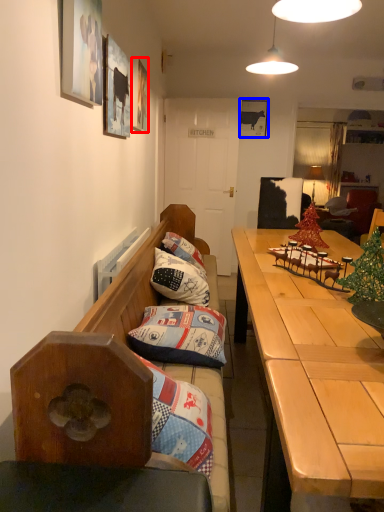
Question: Which object appears closest to the camera in this image, picture frame (highlighted by a red box) or picture frame (highlighted by a blue box)?

Choices:
 (A) picture frame
 (B) picture frame

Answer: (A)